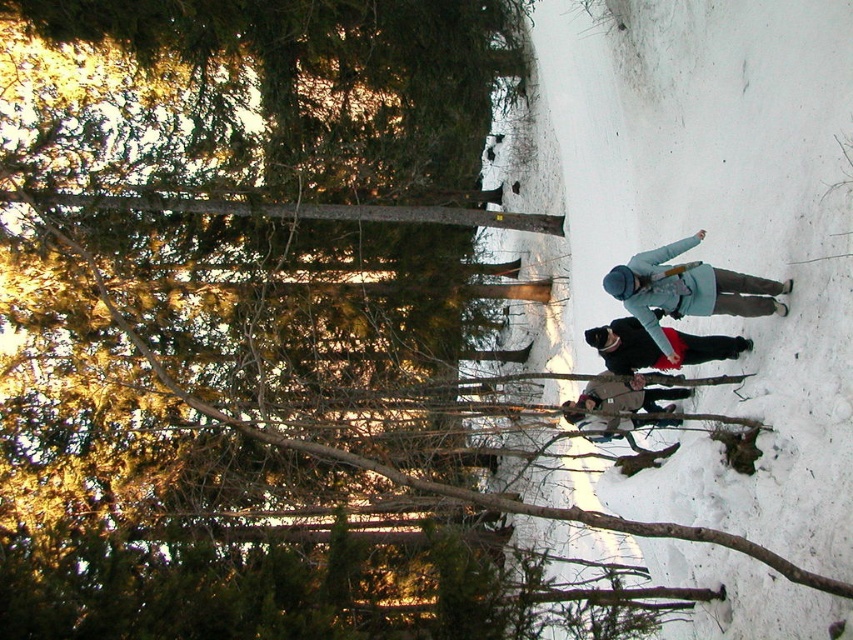
Does matte blue jacket at center have a greater width compared to black fur coat at center?

Correct, the width of matte blue jacket at center exceeds that of black fur coat at center.

Can you confirm if matte blue jacket at center is positioned below black fur coat at center?

→ Incorrect, matte blue jacket at center is not positioned below black fur coat at center.

Which is behind, point (665, 259) or point (630, 353)?

The point (630, 353) is behind.

Identify the location of matte blue jacket at center. (688, 291).

Which is above, matte blue jacket at center or brown woolen jacket at center?

matte blue jacket at center

Image resolution: width=853 pixels, height=640 pixels. Identify the location of matte blue jacket at center. (688, 291).

Which is behind, point (637, 257) or point (636, 417)?

The point (636, 417) is more distant.

The height and width of the screenshot is (640, 853). I want to click on matte blue jacket at center, so click(x=688, y=291).

Can you confirm if black fur coat at center is positioned above brown woolen jacket at center?

Indeed, black fur coat at center is positioned over brown woolen jacket at center.

Does black fur coat at center come in front of brown woolen jacket at center?

No, black fur coat at center is further to the viewer.

Who is more distant from viewer, (706, 339) or (633, 417)?

The point (633, 417) is more distant.

This screenshot has width=853, height=640. In order to click on black fur coat at center in this screenshot , I will do `click(657, 346)`.